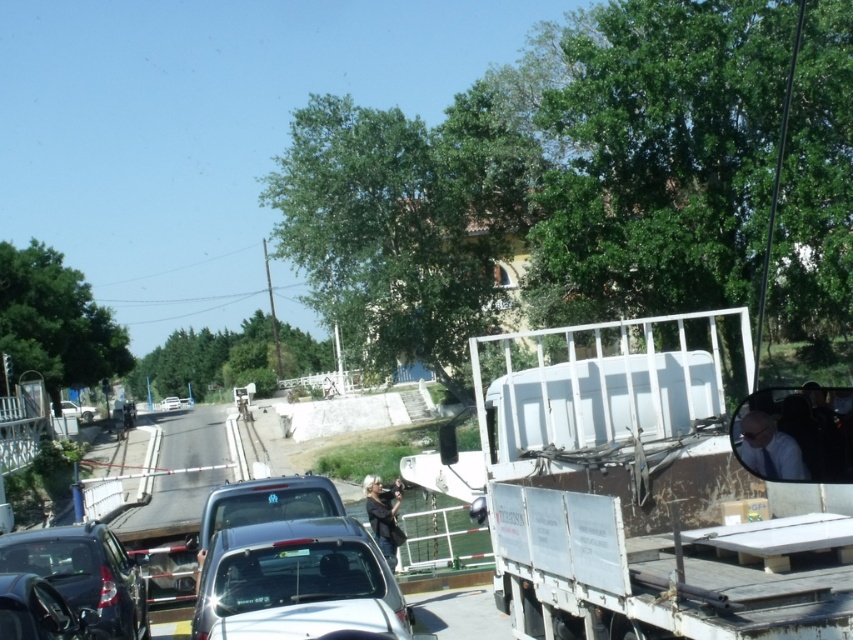
You are a delivery driver who needs to unload the white matte trailer truck at right. The unloading zone is located at point (653, 488). Can you confirm if the white matte trailer truck at right is positioned exactly at the unloading zone?

The white matte trailer truck at right is positioned exactly at point (653, 488), so yes, it is at the unloading zone.